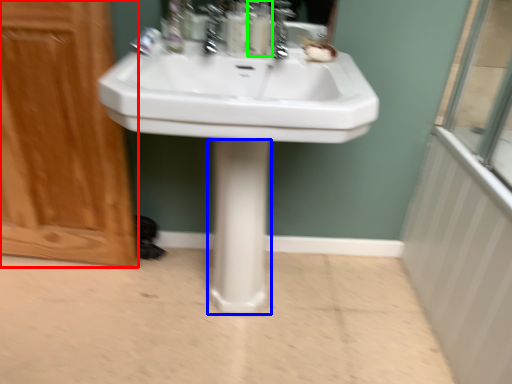
Question: Which is nearer to the screen door (highlighted by a red box)? bidet (highlighted by a blue box) or soap dispenser (highlighted by a green box).

Choices:
 (A) bidet
 (B) soap dispenser

Answer: (A)